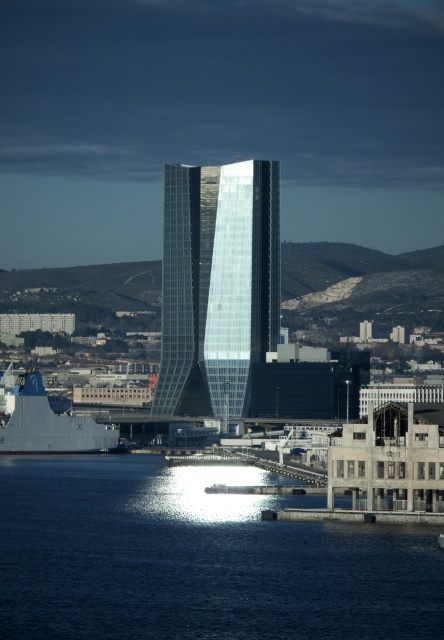
Who is positioned more to the right, blue water at lower left or glassy steel tower at center?

From the viewer's perspective, blue water at lower left appears more on the right side.

Is blue water at lower left behind glassy steel tower at center?

Yes, it is behind glassy steel tower at center.

Describe the element at coordinates (198, 557) in the screenshot. I see `blue water at lower left` at that location.

This screenshot has width=444, height=640. What are the coordinates of `blue water at lower left` in the screenshot? It's located at (198, 557).

Does point (268, 266) come farther from viewer compared to point (34, 413)?

No.

Is point (194, 272) less distant than point (20, 440)?

Yes, point (194, 272) is in front of point (20, 440).

Does point (186, 385) come farther from viewer compared to point (100, 422)?

No, (186, 385) is in front of (100, 422).

What are the coordinates of `glassy steel tower at center` in the screenshot? It's located at (217, 284).

Which is in front, point (175, 540) or point (71, 426)?

Point (175, 540)

Is blue water at lower left further to camera compared to gray metallic ship at lower left?

No, it is in front of gray metallic ship at lower left.

Which is behind, point (84, 586) or point (63, 440)?

The point (84, 586) is behind.

The width and height of the screenshot is (444, 640). In order to click on blue water at lower left in this screenshot , I will do `click(198, 557)`.